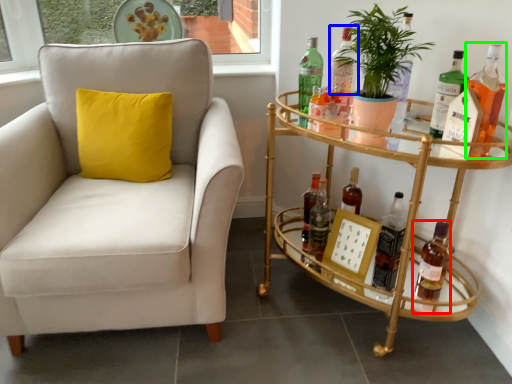
Question: Which object is positioned farthest from bottle (highlighted by a red box)? Select from bottle (highlighted by a blue box) and bottle (highlighted by a green box).

Choices:
 (A) bottle
 (B) bottle

Answer: (A)